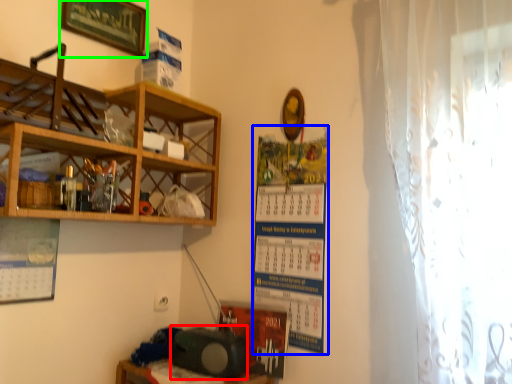
Question: Based on their relative distances, which object is farther from speaker (highlighted by a red box)? Choose from poster (highlighted by a blue box) and picture frame (highlighted by a green box).

Choices:
 (A) poster
 (B) picture frame

Answer: (B)